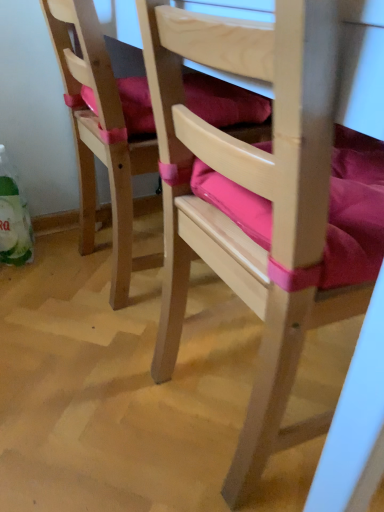
The image size is (384, 512). I want to click on free space that is to the left of wooden chair with pink cushion at center, the second chair in the left-to-right sequence, so click(x=92, y=397).